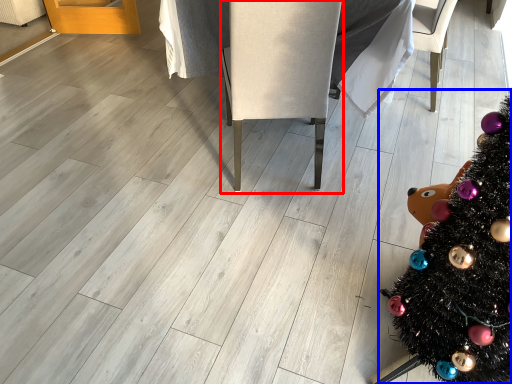
Question: Which point is closer to the camera, armchair (highlighted by a red box) or christmas tree (highlighted by a blue box)?

Choices:
 (A) armchair
 (B) christmas tree

Answer: (B)